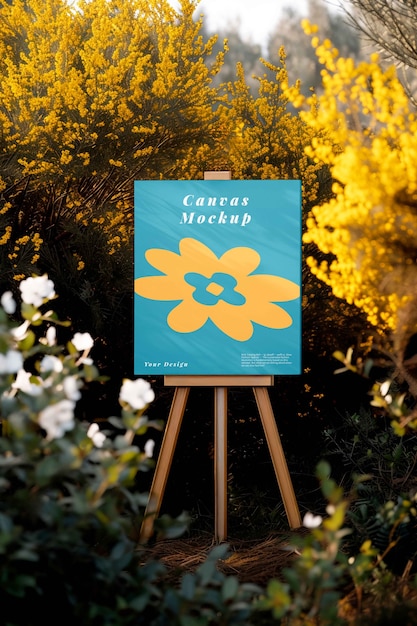
Identify the location of canvas. (216, 237).